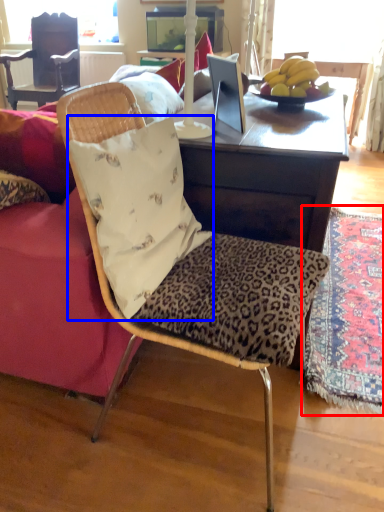
Question: Among these objects, which one is farthest to the camera, mat (highlighted by a red box) or pillow (highlighted by a blue box)?

Choices:
 (A) mat
 (B) pillow

Answer: (A)